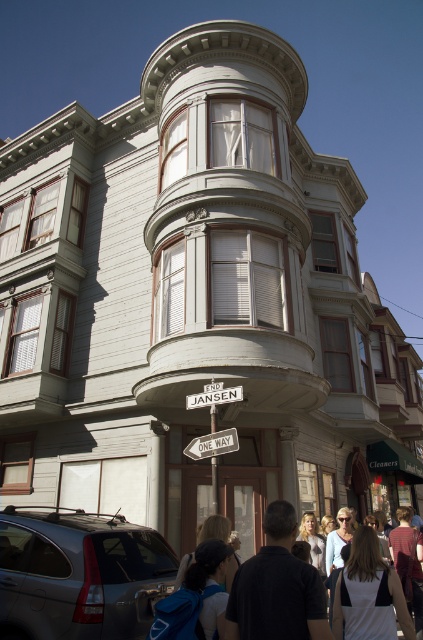
You are a delivery driver approaching the historic Victorian building. You need to park your satin silver suv at lower left in a spot that is closest to the building. Based on its current position, which direction should you move your vehicle to get closer?

The satin silver suv at lower left is already positioned at the closest point to the building, so no movement is needed.